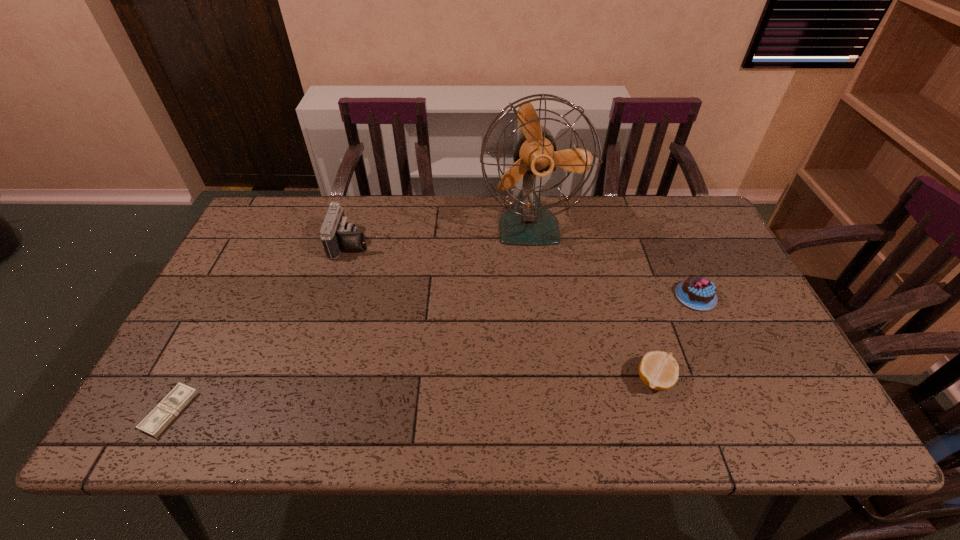
You are a GUI agent. You are given a task and a screenshot of the screen. Output one action in this format:
    pyautogui.click(x=<x>, y=<y>)
    Task: Click on the tallest object
    The width and height of the screenshot is (960, 540).
    Given the screenshot: What is the action you would take?
    pyautogui.click(x=526, y=222)

Locate an element on the screen. fan is located at coordinates (526, 222).

The height and width of the screenshot is (540, 960). Identify the location of the second tallest object. point(337,234).

Identify the location of camera. This screenshot has height=540, width=960. (337, 234).

Identify the location of the rightmost object. (699, 293).

This screenshot has width=960, height=540. I want to click on chocolate cake, so click(699, 293).

What are the coordinates of `lemon` in the screenshot? It's located at (658, 370).

Identify the location of the second object from right to left. (658, 370).

The height and width of the screenshot is (540, 960). Identify the location of money. (162, 415).

I want to click on the shortest object, so click(162, 415).